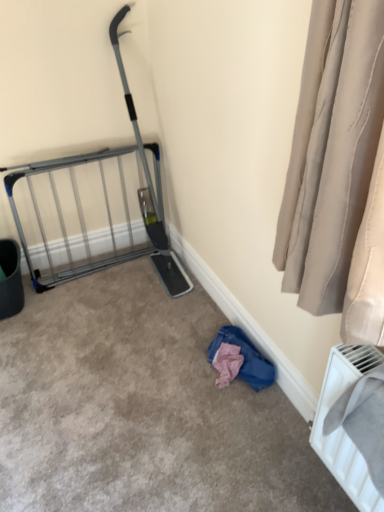
Question: Is silver metallic gate at left spatially inside white plastic radiator at lower right, or outside of it?

Choices:
 (A) inside
 (B) outside

Answer: (B)

Question: Is point (153, 157) closer or farther from the camera than point (360, 472)?

Choices:
 (A) farther
 (B) closer

Answer: (A)

Question: Estimate the real-world distances between objects in this image. Which object is farther from the silver metallic gate at left?

Choices:
 (A) white plastic radiator at lower right
 (B) pink fabric at lower right

Answer: (A)

Question: Which is farther from the white plastic radiator at lower right?

Choices:
 (A) pink fabric at lower right
 (B) silver metallic gate at left

Answer: (B)